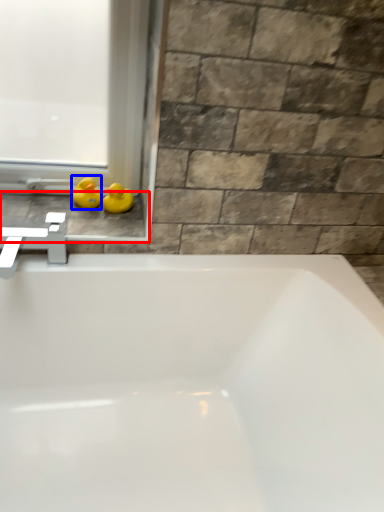
Question: Among these objects, which one is nearest to the camera, window sill (highlighted by a red box) or duck (highlighted by a blue box)?

Choices:
 (A) window sill
 (B) duck

Answer: (A)